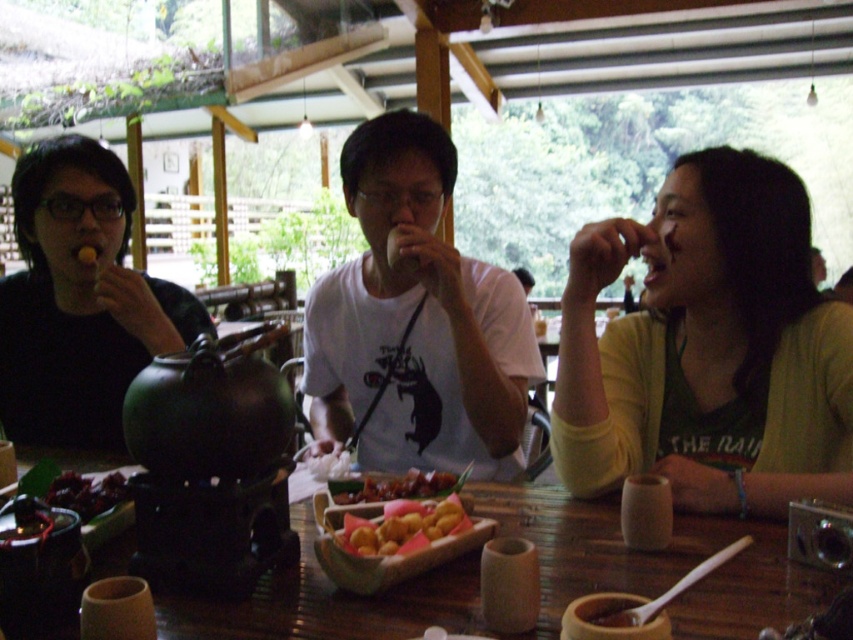
Question: Which object is the farthest from the golden crispy balls at center?

Choices:
 (A) golden fried dumplings at center
 (B) yellow matte food at center
 (C) wooden table at center
 (D) black matte shirt at left

Answer: (B)

Question: Is white matte t-shirt at center to the left of shiny red sauce at center from the viewer's perspective?

Choices:
 (A) no
 (B) yes

Answer: (B)

Question: Can you confirm if golden crispy balls at center is wider than shiny dark red berries at lower left?

Choices:
 (A) yes
 (B) no

Answer: (A)

Question: From the image, what is the correct spatial relationship of black matte shirt at left in relation to shiny red sauce at center?

Choices:
 (A) right
 (B) left

Answer: (B)

Question: Among these points, which one is farthest from the camera?

Choices:
 (A) (726, 148)
 (B) (78, 500)
 (C) (756, 568)
 (D) (422, 509)

Answer: (A)

Question: Which of the following is the closest to the observer?

Choices:
 (A) shiny dark red berries at lower left
 (B) golden fried dumplings at center
 (C) white matte t-shirt at center

Answer: (B)